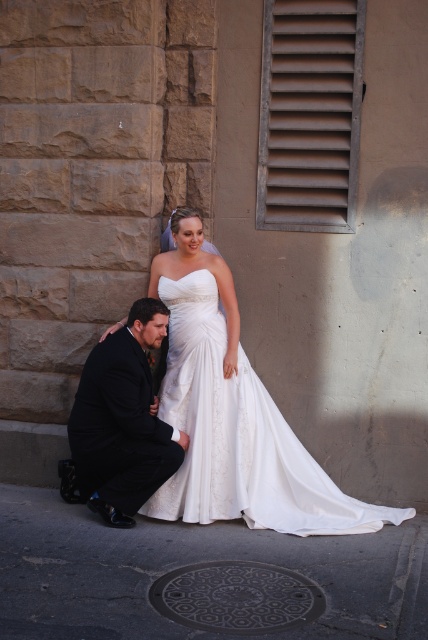
Can you confirm if white satin dress at center is taller than dark suit at lower left?

Yes.

Is white satin dress at center shorter than dark suit at lower left?

No.

Is point (196, 301) positioned behind point (86, 444)?

Yes, it is behind point (86, 444).

Where is `white satin dress at center`? white satin dress at center is located at coordinates (240, 436).